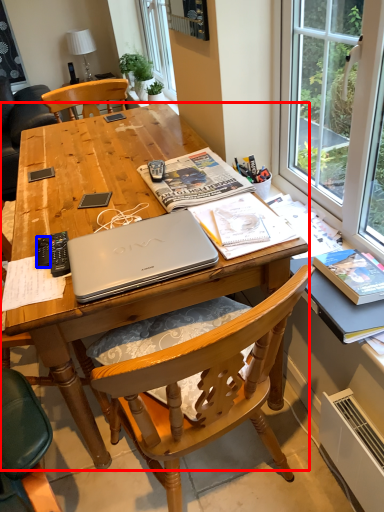
Question: Which object is further to the camera taking this photo, desk (highlighted by a red box) or remote control (highlighted by a blue box)?

Choices:
 (A) desk
 (B) remote control

Answer: (B)